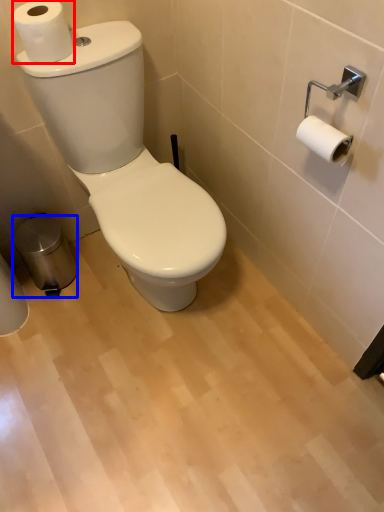
Question: Which of the following is the closest to the observer, toilet paper (highlighted by a red box) or trash bin/can (highlighted by a blue box)?

Choices:
 (A) toilet paper
 (B) trash bin/can

Answer: (A)